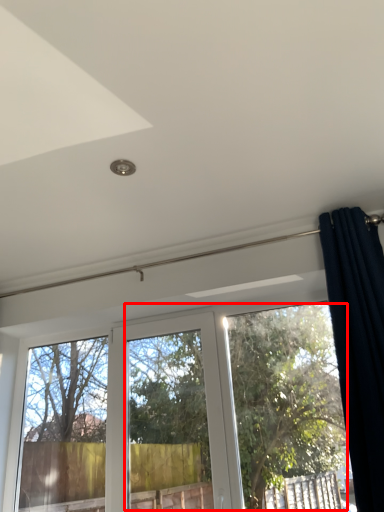
Question: From the image's perspective, where is tree (annotated by the red box) located in relation to curtain in the image?

Choices:
 (A) above
 (B) below

Answer: (B)